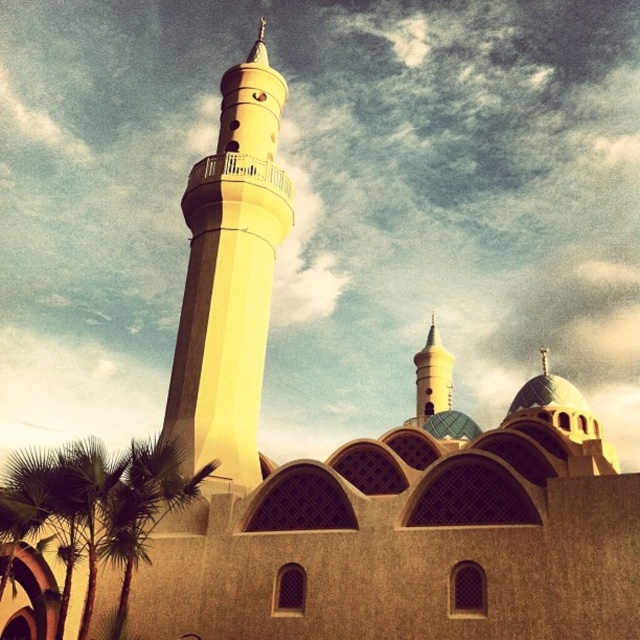
The height and width of the screenshot is (640, 640). What do you see at coordinates (228, 278) in the screenshot? I see `yellow concrete minaret at center` at bounding box center [228, 278].

Is yellow concrete minaret at center behind green leafy palm tree at lower left?

That is True.

What do you see at coordinates (228, 278) in the screenshot?
I see `yellow concrete minaret at center` at bounding box center [228, 278].

This screenshot has width=640, height=640. Find the location of `yellow concrete minaret at center`. yellow concrete minaret at center is located at coordinates click(228, 278).